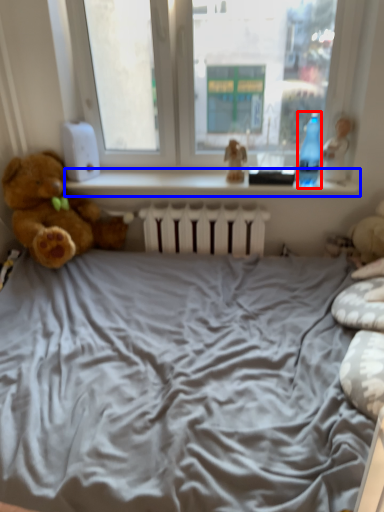
Question: Among these objects, which one is farthest to the camera, bottle (highlighted by a red box) or window sill (highlighted by a blue box)?

Choices:
 (A) bottle
 (B) window sill

Answer: (B)